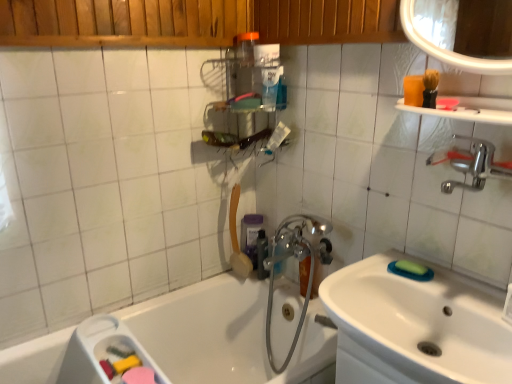
This screenshot has width=512, height=384. What are the coordinates of `free space in front of green sponge at sink` in the screenshot? It's located at (459, 294).